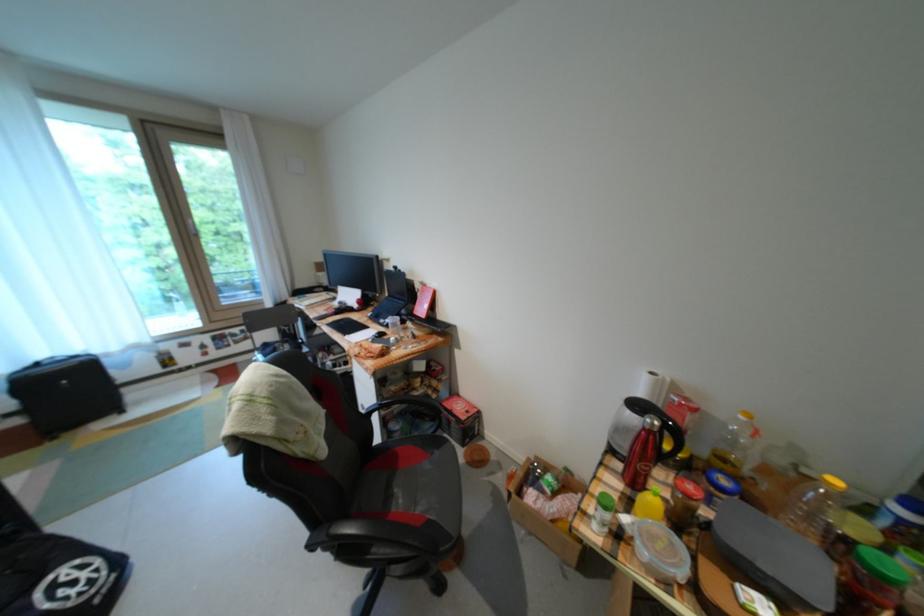
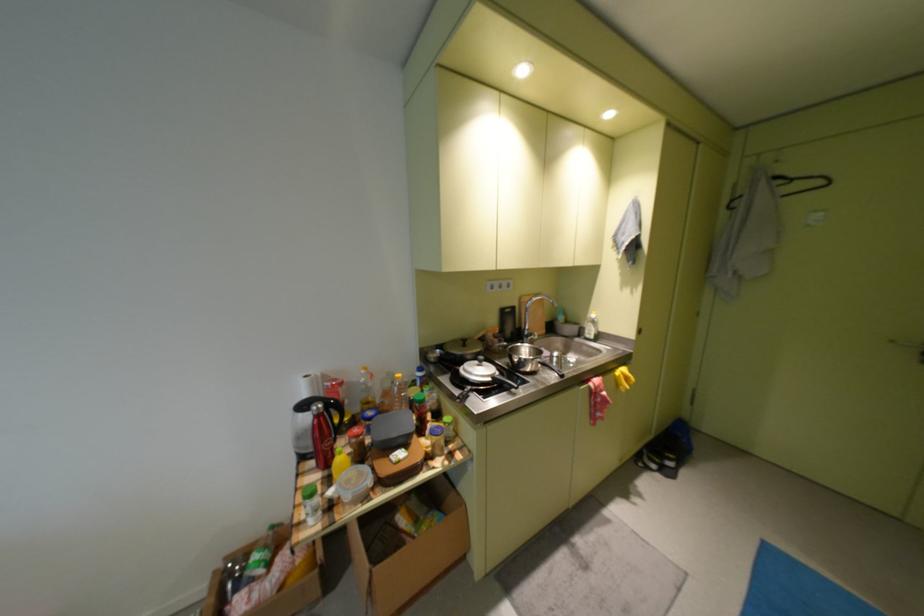
Question: Based on the continuous images, in which direction is the camera rotating? Reply with the corresponding letter.

Choices:
 (A) Left
 (B) Right
 (C) Up
 (D) Down

Answer: (B)